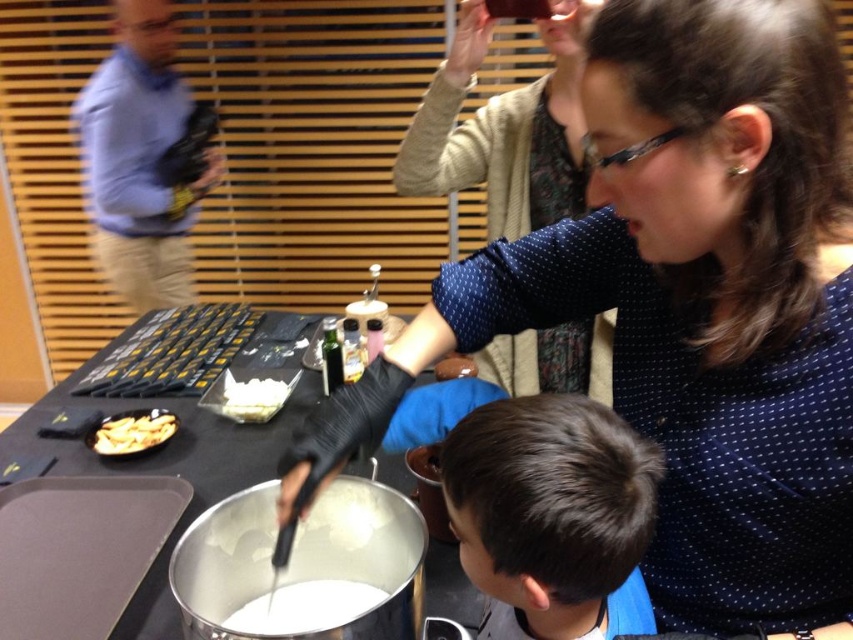
You are standing in front of the table at the cooking demonstration. You notice two points marked on the table. Which point is closer to you, point (656, 314) or point (492, 572)?

Point (492, 572) is closer to you because it is less far from the camera than point (656, 314).

You are standing in front of the table and want to find the matte black shirt at center. Where should you look?

You should look at point (693, 304) to find the matte black shirt at center.

You are organizing a clothing donation drive and need to sort shirts by size. You have a matte black shirt at upper right and a blue shirt at left. Which shirt should you place in the small size bin?

The matte black shirt at upper right should be placed in the small size bin because its width is less than the blue shirt at left.